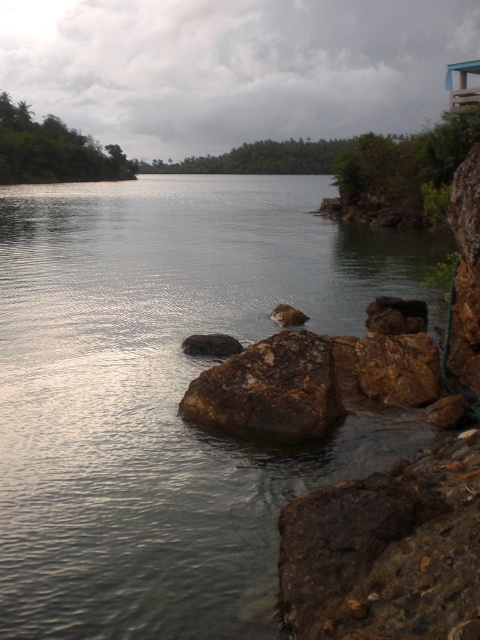
This screenshot has width=480, height=640. What do you see at coordinates (398, 369) in the screenshot?
I see `brown rough rock at right` at bounding box center [398, 369].

Who is taller, brown rough rock at right or brown rough rock at center?

With more height is brown rough rock at right.

Find the location of a particular element. Image resolution: width=480 pixels, height=640 pixels. brown rough rock at right is located at coordinates (398, 369).

This screenshot has width=480, height=640. I want to click on brown rough rock at right, so point(398,369).

Between brown rough rock at right and rusty metallic rock at center, which one is positioned higher?

Positioned higher is rusty metallic rock at center.

Does brown rough rock at right have a lesser width compared to rusty metallic rock at center?

No, brown rough rock at right is not thinner than rusty metallic rock at center.

Based on the photo, who is more forward, (425, 349) or (222, 352)?

Positioned in front is point (425, 349).

Find the location of a particular element. The image size is (480, 640). brown rough rock at right is located at coordinates (398, 369).

Is rusty rock at center thinner than rusty metallic rock at center?

No.

Is rusty rock at center bigger than rusty metallic rock at center?

Yes.

Which is in front, point (288, 413) or point (212, 337)?

Positioned in front is point (288, 413).

This screenshot has width=480, height=640. I want to click on rusty rock at center, so click(x=269, y=390).